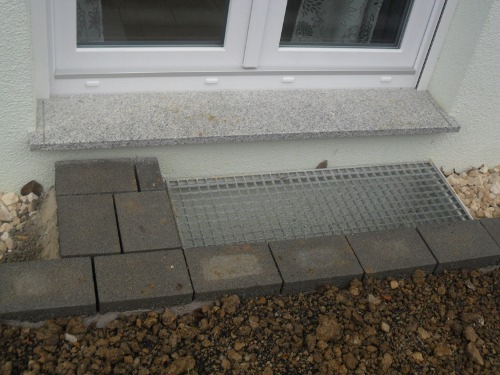
Where is `window curtains`? The image size is (500, 375). window curtains is located at coordinates (90, 30), (323, 27).